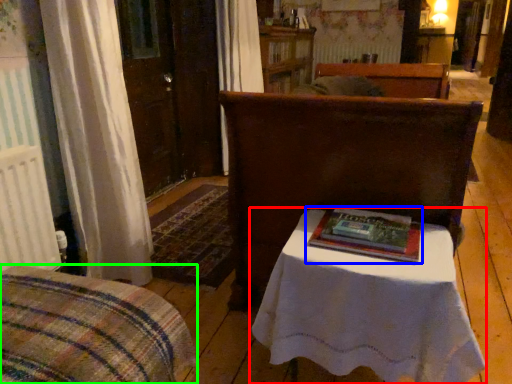
Question: Estimate the real-world distances between objects in this image. Which object is farther from table (highlighted by a red box), book (highlighted by a blue box) or furniture (highlighted by a green box)?

Choices:
 (A) book
 (B) furniture

Answer: (B)